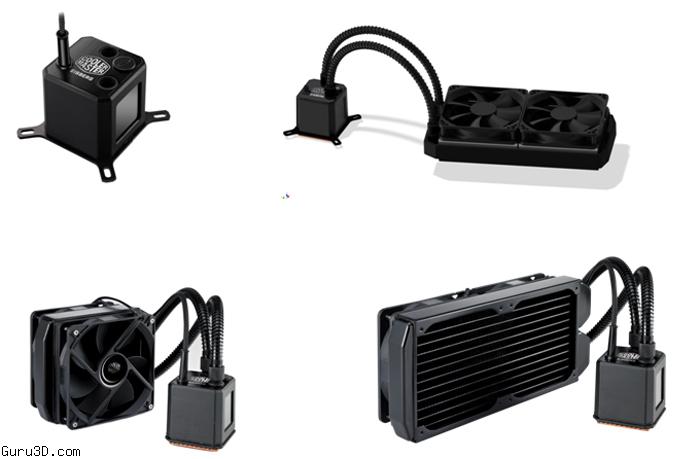
Find the location of a particular element. This screenshot has height=459, width=700. square plastic box is located at coordinates (52, 110).